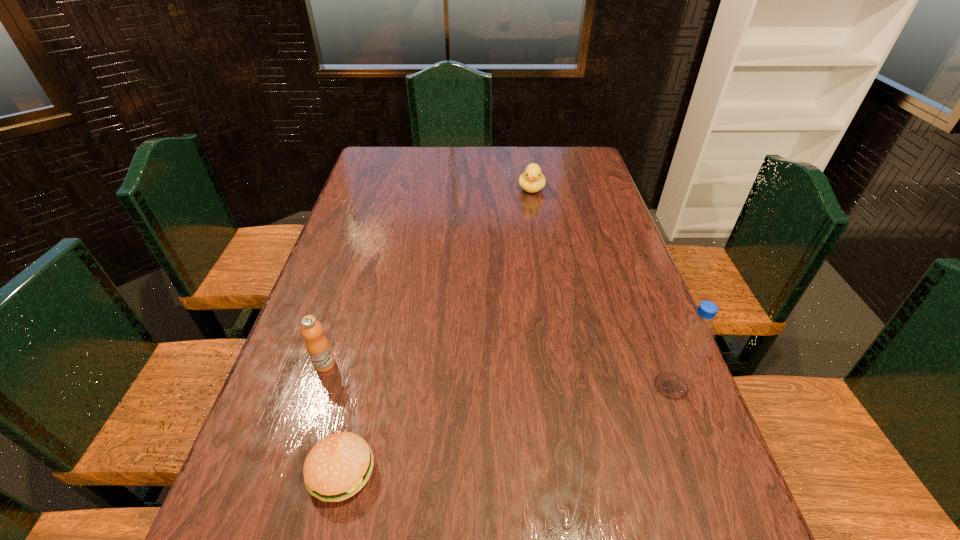
Locate an element on the screen. The image size is (960, 540). vacant point located 0.100m on the beak of the duckling is located at coordinates (531, 214).

Locate an element on the screen. The width and height of the screenshot is (960, 540). free space located on the beak of the duckling is located at coordinates (530, 259).

Where is `vacant space positioned on the beak of the duckling`? This screenshot has height=540, width=960. vacant space positioned on the beak of the duckling is located at coordinates (530, 270).

Where is `vacant space located on the front label of the second farthest object`? This screenshot has width=960, height=540. vacant space located on the front label of the second farthest object is located at coordinates (356, 374).

Locate an element on the screen. Image resolution: width=960 pixels, height=540 pixels. vacant region located on the front label of the second farthest object is located at coordinates (408, 390).

You are a GUI agent. You are given a task and a screenshot of the screen. Output one action in this format:
    pyautogui.click(x=<x>, y=<y>)
    Task: Click on the vacant space located 0.140m on the front label of the second farthest object
    The image size is (960, 540).
    Given the screenshot: What is the action you would take?
    pyautogui.click(x=388, y=384)

Identify the location of object that is at the near edge. Image resolution: width=960 pixels, height=540 pixels. (339, 465).

Locate an element on the screen. The width and height of the screenshot is (960, 540). patty positioned at the left edge is located at coordinates (339, 465).

You are a GUI agent. You are given a task and a screenshot of the screen. Output one action in this format:
    pyautogui.click(x=<x>, y=<y>)
    Task: Click on the orange juice located in the left edge section of the desktop
    
    Given the screenshot: What is the action you would take?
    pyautogui.click(x=318, y=347)

Find the location of a particular element. The width and height of the screenshot is (960, 540). object situated at the right edge is located at coordinates (695, 335).